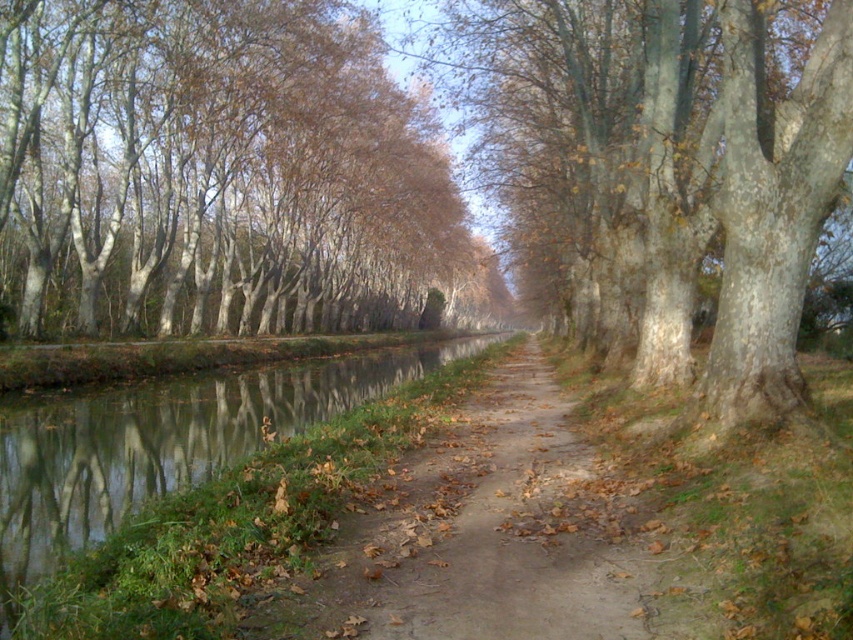
Question: Can you confirm if smooth bark trees at left is thinner than brown dirt path at center?

Choices:
 (A) yes
 (B) no

Answer: (B)

Question: Which of the following is the closest to the observer?

Choices:
 (A) (732, 324)
 (B) (341, 531)
 (C) (38, 186)
 (D) (154, 532)

Answer: (D)

Question: Is smooth bark trees at left below green reflective water at center?

Choices:
 (A) no
 (B) yes

Answer: (A)

Question: Does smooth bark trees at left have a larger size compared to green reflective water at center?

Choices:
 (A) no
 (B) yes

Answer: (B)

Question: Which point appears closest to the camera in this image?

Choices:
 (A) (502, 291)
 (B) (418, 604)
 (C) (746, 385)

Answer: (B)

Question: Based on their relative distances, which object is farther from the brown dirt path at center?

Choices:
 (A) smooth bark trees at left
 (B) smooth gray bark tree at center

Answer: (A)